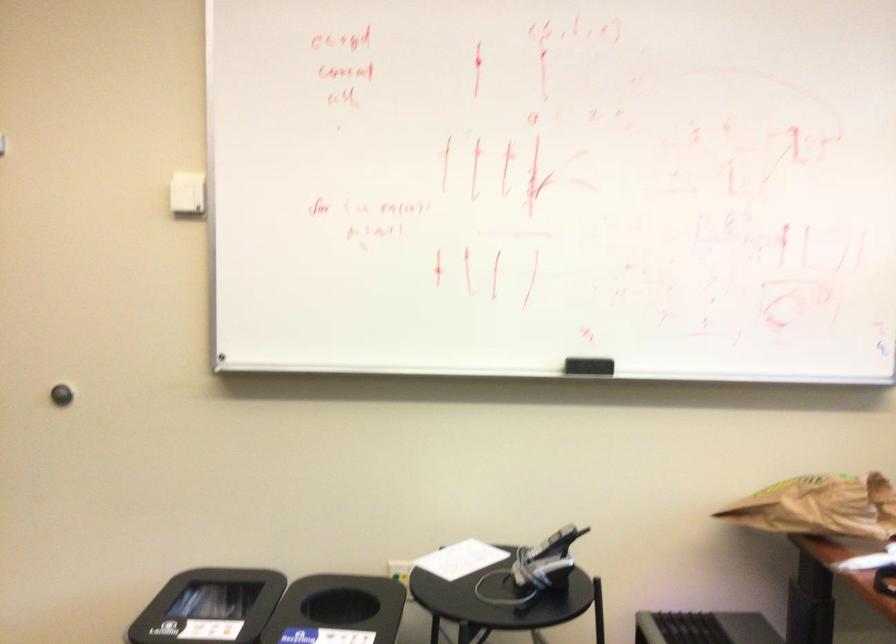
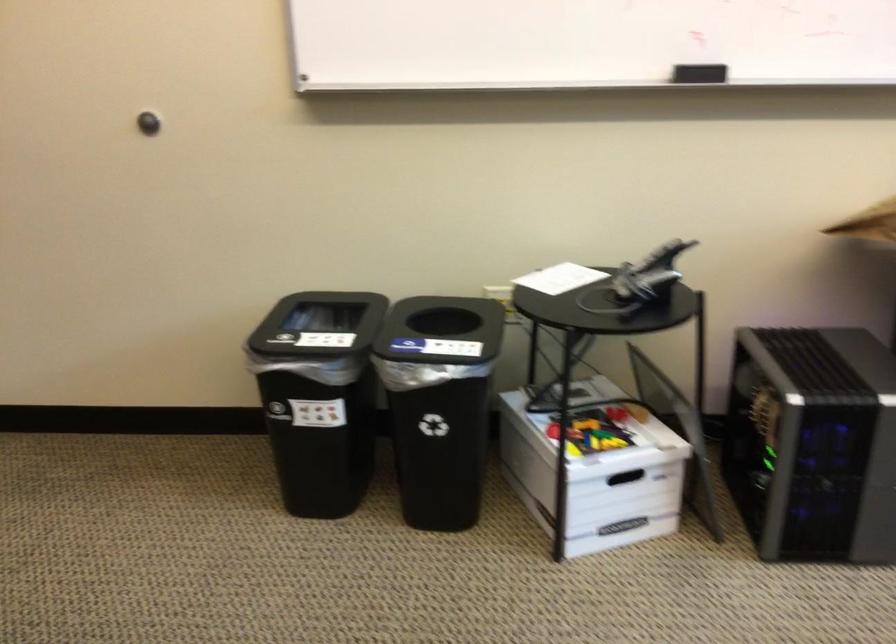
Question: The images are taken continuously from a first-person perspective. In which direction is your viewpoint rotating?

Choices:
 (A) Left
 (B) Right
 (C) Up
 (D) Down

Answer: (D)